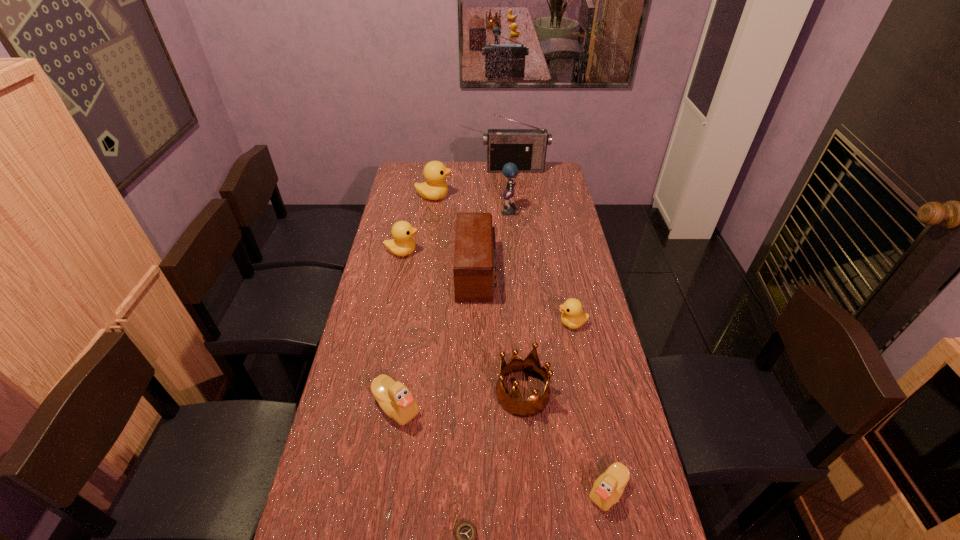
At what (x,y) coordinates should I click in order to perform the action: click on the third closest yellow duck to the second tallest object. Please return your answer as a coordinate pair (x, y). The width and height of the screenshot is (960, 540). Looking at the image, I should click on (572, 316).

Identify which yellow duck is located as the second nearest to the crown. Please provide its 2D coordinates. Your answer should be formatted as a tuple, i.e. [(x, y)], where the tuple contains the x and y coordinates of a point satisfying the conditions above.

[(403, 244)]

The width and height of the screenshot is (960, 540). Identify the location of free point that satisfies the following two spatial constraints: 1. on the front-facing side of the taller radio receiver; 2. on the face of the second farthest yellow duck. (525, 252).